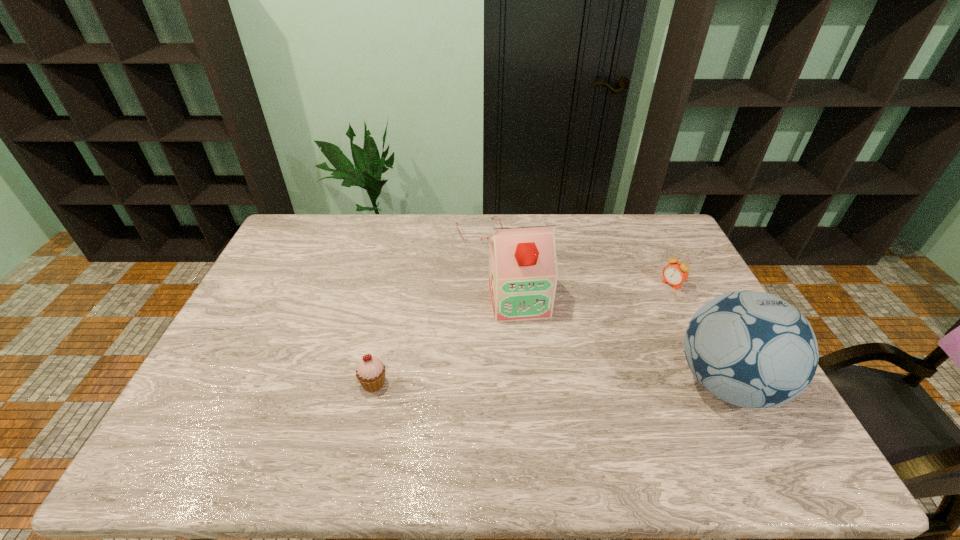
Locate an element on the screen. The width and height of the screenshot is (960, 540). unoccupied area between the cupcake and the soya milk is located at coordinates (446, 342).

I want to click on empty location between the leftmost object and the spectacles, so click(426, 308).

Locate an element on the screen. This screenshot has height=540, width=960. vacant space that's between the cupcake and the soccer ball is located at coordinates (550, 383).

You are a GUI agent. You are given a task and a screenshot of the screen. Output one action in this format:
    pyautogui.click(x=<x>, y=<y>)
    Task: Click on the empty location between the leftmost object and the farthest object
    
    Given the screenshot: What is the action you would take?
    pyautogui.click(x=426, y=308)

Where is `free point between the alarm clock and the shortest object`? This screenshot has width=960, height=540. free point between the alarm clock and the shortest object is located at coordinates (576, 258).

Locate an element on the screen. The image size is (960, 540). object that is the third nearest to the shortest object is located at coordinates (370, 372).

The height and width of the screenshot is (540, 960). Find the location of `object that is the fourth nearest to the alarm clock`. object that is the fourth nearest to the alarm clock is located at coordinates (370, 372).

Find the location of `vacant area that satisfies the following two spatial constraints: 1. on the back side of the soya milk; 2. on the right side of the leftmost object`. vacant area that satisfies the following two spatial constraints: 1. on the back side of the soya milk; 2. on the right side of the leftmost object is located at coordinates (392, 301).

Find the location of a particular element. The height and width of the screenshot is (540, 960). blank space that satisfies the following two spatial constraints: 1. on the front side of the soccer ball; 2. on the side with brand of the soya milk is located at coordinates (527, 383).

At what (x,y) coordinates should I click in order to perform the action: click on free spot that satisfies the following two spatial constraints: 1. on the front side of the soya milk; 2. on the right side of the farthest object. Please return your answer as a coordinate pair (x, y). Looking at the image, I should click on 480,301.